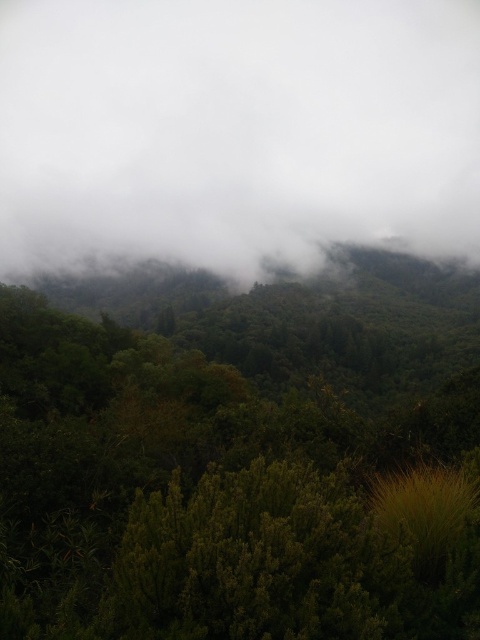
You are a bird flying over the lush landscape. You see the green leafy tree at center and the white fluffy cloud at upper center. Which object is closer to the ground?

The green leafy tree at center is closer to the ground than the white fluffy cloud at upper center because it is shorter.

You are a bird soaring high above the lush landscape. You spot the green leafy tree at center and the white fluffy cloud at upper center. Which object is closer to you, the observer?

The white fluffy cloud at upper center is closer to you since it is positioned higher in the sky compared to the green leafy tree at center, which is on the ground.

You are standing in the lush, verdant landscape described. You need to locate the green leafy tree at center. According to the coordinates provided, where should you look to find it?

The green leafy tree at center is located at coordinates point (240, 454).